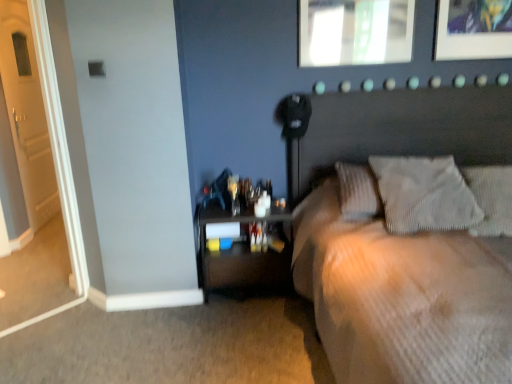
Question: Could you tell me if matte glass picture frame at upper center is facing white wooden door at left?

Choices:
 (A) no
 (B) yes

Answer: (A)

Question: Does matte glass picture frame at upper center touch white wooden door at left?

Choices:
 (A) no
 (B) yes

Answer: (A)

Question: From a real-world perspective, is matte glass picture frame at upper center physically below white wooden door at left?

Choices:
 (A) yes
 (B) no

Answer: (B)

Question: From the image's perspective, would you say matte glass picture frame at upper center is shown under white wooden door at left?

Choices:
 (A) yes
 (B) no

Answer: (B)

Question: Does matte glass picture frame at upper center have a larger size compared to white wooden door at left?

Choices:
 (A) yes
 (B) no

Answer: (B)

Question: In terms of height, does beige textured bed at center look taller or shorter compared to textured gray pillow at upper right, the second pillow viewed from the left?

Choices:
 (A) tall
 (B) short

Answer: (A)

Question: From the image's perspective, is beige textured bed at center positioned above or below textured gray pillow at upper right, the second pillow viewed from the left?

Choices:
 (A) below
 (B) above

Answer: (A)

Question: In the image, is beige textured bed at center positioned in front of or behind textured gray pillow at upper right, marked as the 1th pillow in a right-to-left arrangement?

Choices:
 (A) behind
 (B) front

Answer: (B)

Question: Does point (316, 168) appear closer or farther from the camera than point (495, 198)?

Choices:
 (A) closer
 (B) farther

Answer: (B)

Question: Choose the correct answer: Is white textured pillow at upper right, placed as the first pillow when sorted from left to right, inside matte glass picture frame at upper center or outside it?

Choices:
 (A) outside
 (B) inside

Answer: (A)

Question: Is white textured pillow at upper right, which appears as the second pillow when viewed from the right, bigger or smaller than matte glass picture frame at upper center?

Choices:
 (A) small
 (B) big

Answer: (B)

Question: In terms of height, does white textured pillow at upper right, which appears as the second pillow when viewed from the right, look taller or shorter compared to matte glass picture frame at upper center?

Choices:
 (A) short
 (B) tall

Answer: (A)

Question: Is point (431, 206) positioned closer to the camera than point (339, 6)?

Choices:
 (A) farther
 (B) closer

Answer: (B)

Question: Would you say white wooden door at left is inside or outside textured gray pillow at upper right, the second pillow viewed from the left?

Choices:
 (A) outside
 (B) inside

Answer: (A)

Question: In terms of width, does white wooden door at left look wider or thinner when compared to textured gray pillow at upper right, marked as the 1th pillow in a right-to-left arrangement?

Choices:
 (A) thin
 (B) wide

Answer: (A)